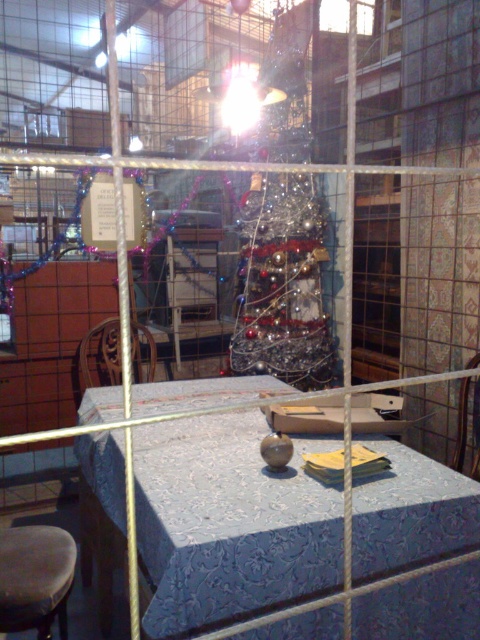
Who is shorter, shiny metallic christmas tree at center or brown leather stool at lower left?

With less height is brown leather stool at lower left.

Who is more forward, [320,340] or [34,534]?

Point [34,534] is more forward.

At what (x,y) coordinates should I click in order to perform the action: click on shiny metallic christmas tree at center. Please return your answer as a coordinate pair (x, y). Looking at the image, I should click on [282, 284].

Which is above, blue fabric table at center or shiny metallic christmas tree at center?

shiny metallic christmas tree at center is above.

Does blue fabric table at center appear on the right side of shiny metallic christmas tree at center?

In fact, blue fabric table at center is to the left of shiny metallic christmas tree at center.

You are a GUI agent. You are given a task and a screenshot of the screen. Output one action in this format:
    pyautogui.click(x=<x>, y=<y>)
    Task: Click on the blue fabric table at center
    This screenshot has height=640, width=480.
    Given the screenshot: What is the action you would take?
    pyautogui.click(x=228, y=524)

Who is positioned more to the right, blue fabric table at center or brown leather stool at lower left?

From the viewer's perspective, blue fabric table at center appears more on the right side.

What do you see at coordinates (228, 524) in the screenshot?
I see `blue fabric table at center` at bounding box center [228, 524].

Who is more forward, (245, 579) or (20, 589)?

Point (245, 579) is in front.

Locate an element on the screen. blue fabric table at center is located at coordinates (228, 524).